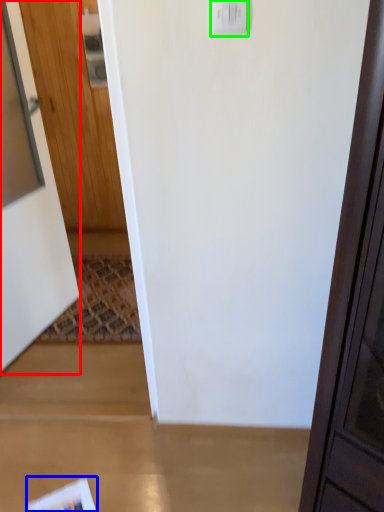
Question: Considering the real-world distances, which object is farthest from door (highlighted by a red box)? magazine (highlighted by a blue box) or light switch (highlighted by a green box)?

Choices:
 (A) magazine
 (B) light switch

Answer: (B)